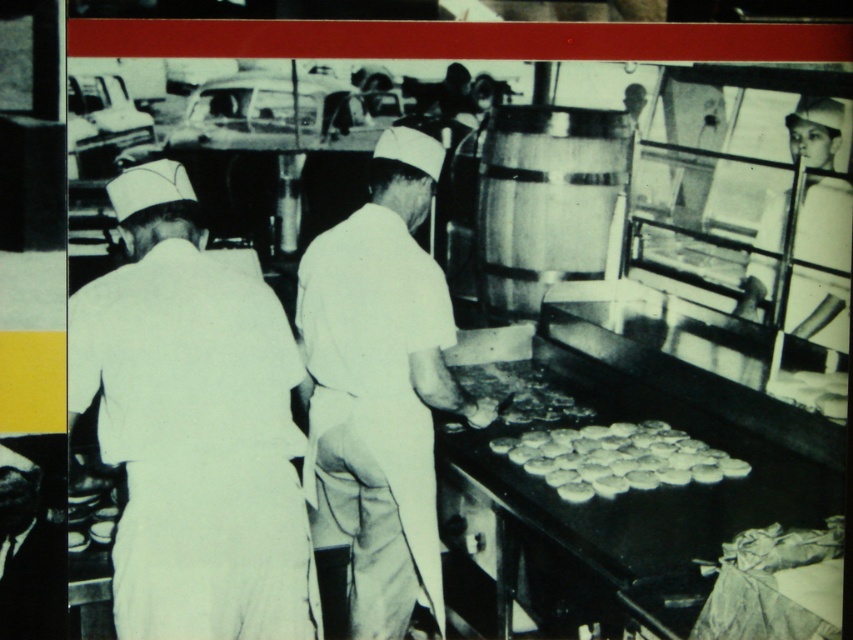
You are a chef in a busy kitchen and need to quickly grab both the white matte cookies at center and the crumbly golden bread at center. Given that your reach is 14 inches, can you grab both items without moving your position?

The white matte cookies at center is 14.64 inches away from the crumbly golden bread at center. Since your reach is only 14 inches, you cannot grab both items without moving your position.

You are a new chef in the kitchen and need to grab the crumbly golden bread at center. Which direction should you move from the white uniform at left to reach it?

The crumbly golden bread at center is to the right of the white uniform at left, so you should move to the right from the white uniform at left to reach it.